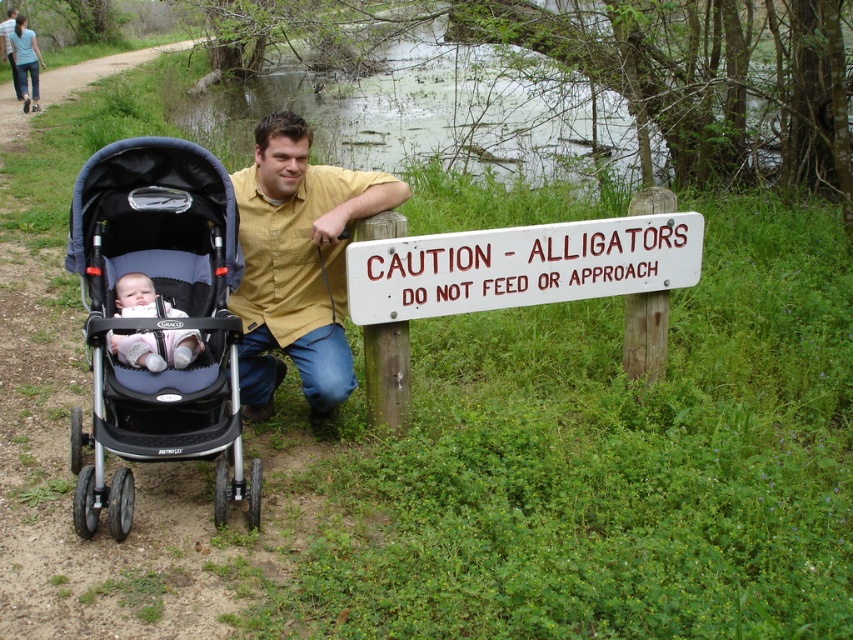
Question: Observing the image, what is the correct spatial positioning of yellow shirt at center in reference to white painted wood sign at center?

Choices:
 (A) above
 (B) below

Answer: (B)

Question: Does black fabric stroller at left have a larger size compared to yellow shirt at center?

Choices:
 (A) yes
 (B) no

Answer: (B)

Question: Which point is farther to the camera?

Choices:
 (A) black fabric stroller at left
 (B) soft pink fabric baby at center
 (C) white painted wood sign at center
 (D) yellow shirt at center

Answer: (C)

Question: Does black fabric stroller at left have a smaller size compared to soft pink fabric baby at center?

Choices:
 (A) yes
 (B) no

Answer: (B)

Question: Which is nearer to the yellow shirt at center?

Choices:
 (A) black fabric stroller at left
 (B) white painted wood sign at center

Answer: (A)

Question: Which point is closer to the camera?

Choices:
 (A) (286, 138)
 (B) (200, 262)
 (C) (170, 337)
 (D) (459, 237)

Answer: (C)